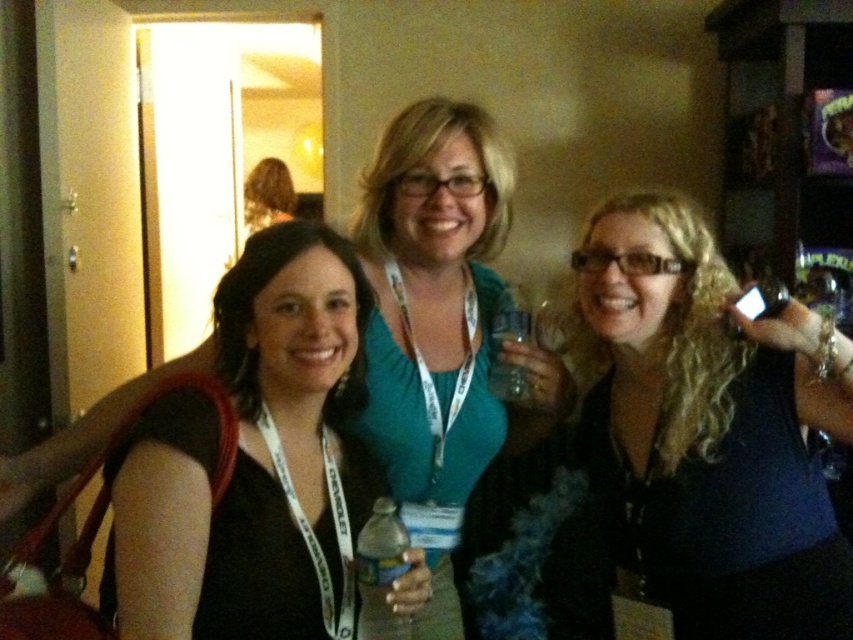
Question: Which of the following is the closest to the observer?

Choices:
 (A) translucent plastic water bottle at center
 (B) black fabric shirt at right

Answer: (A)

Question: Considering the relative positions of black fabric shirt at right and black fabric at center in the image provided, where is black fabric shirt at right located with respect to black fabric at center?

Choices:
 (A) right
 (B) left

Answer: (A)

Question: Observing the image, what is the correct spatial positioning of black fabric at center in reference to translucent plastic water bottle at center?

Choices:
 (A) above
 (B) below

Answer: (A)

Question: Which point is closer to the camera taking this photo?

Choices:
 (A) (363, 586)
 (B) (216, 520)
 (C) (786, 435)

Answer: (A)

Question: Among these points, which one is farthest from the camera?

Choices:
 (A) (659, 280)
 (B) (350, 532)

Answer: (A)

Question: Does black fabric shirt at right have a lesser width compared to translucent plastic water bottle at center?

Choices:
 (A) yes
 (B) no

Answer: (B)